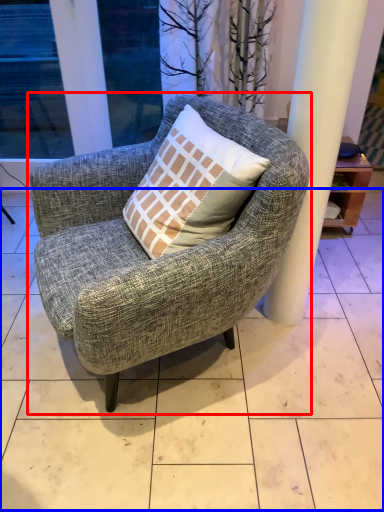
Question: Which point is further to the camera, chair (highlighted by a red box) or tile (highlighted by a blue box)?

Choices:
 (A) chair
 (B) tile

Answer: (B)